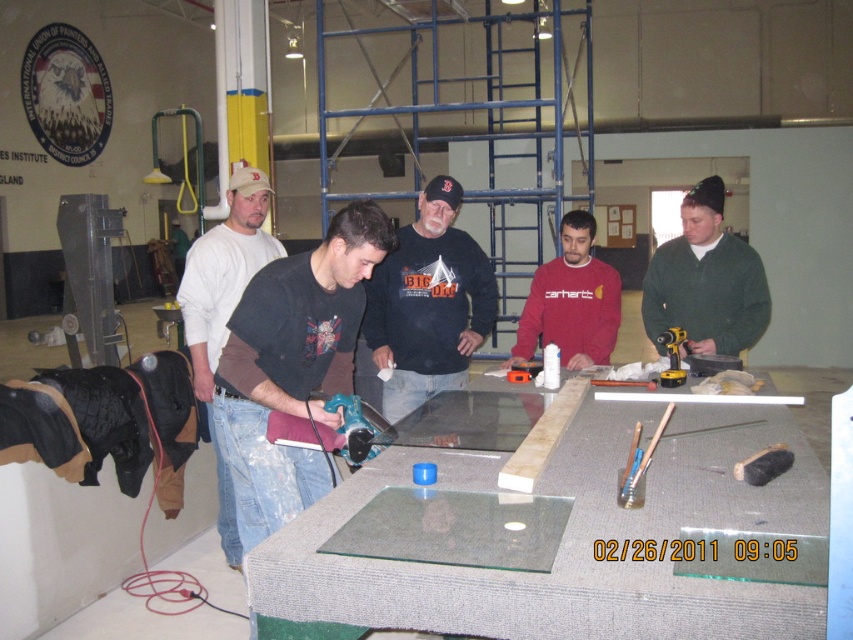
You are standing in the workshop and need to hand a tool to the person wearing the black matte shirt at center and the white cotton shirt at center. Which person should you approach first to ensure you can reach them without moving closer?

You should approach the black matte shirt at center first because it is closer to you than the white cotton shirt at center.

You are a safety inspector checking the workspace. You notice the white cotton shirt at center and the blue plastic drill at center. According to safety protocols, should the shirt be moved away from the drill?

Yes, the white cotton shirt at center is positioned over the blue plastic drill at center, which violates safety protocols as loose clothing can get caught in machinery. Move the shirt away from the drill.

You are a safety inspector in the workshop. You need to ensure that the white cotton shirt at center and the blue plastic drill at center are arranged properly. According to safety regulations, the taller object must be placed behind the shorter one to prevent blocking the view. Which object should be placed behind the other?

The white cotton shirt at center has a greater height compared to the blue plastic drill at center, so the white cotton shirt at center should be placed behind the blue plastic drill at center to prevent blocking the view.